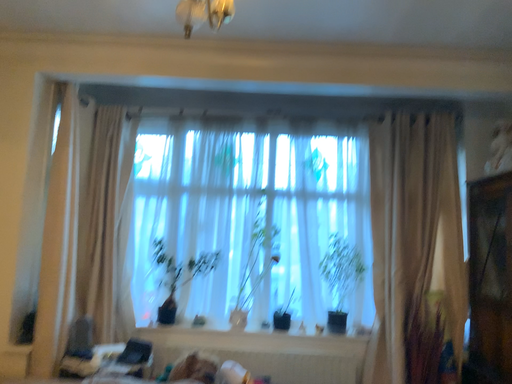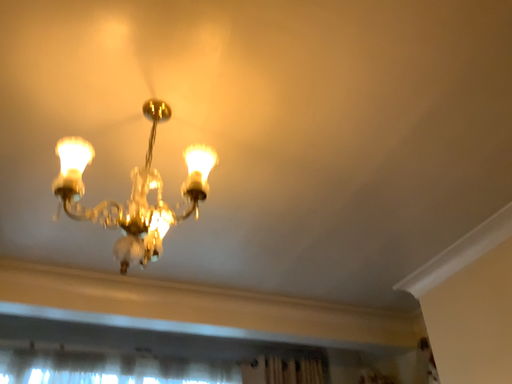
Question: Which way did the camera rotate in the video?

Choices:
 (A) rotated downward
 (B) rotated upward

Answer: (B)